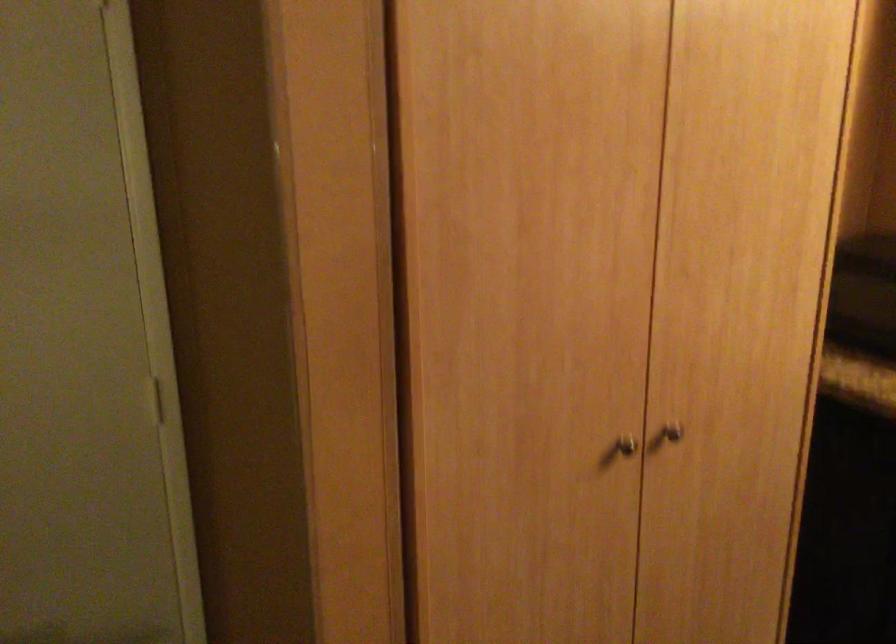
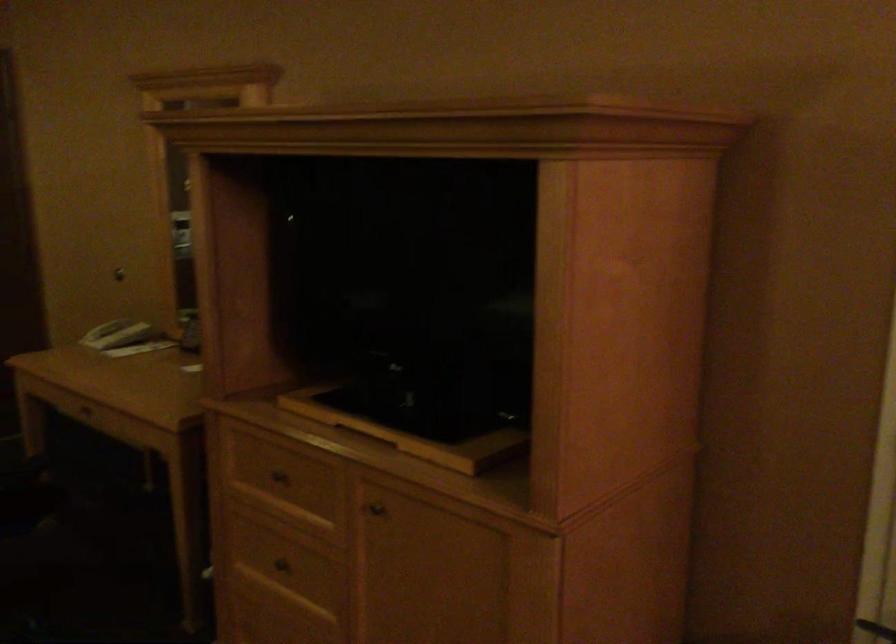
Question: The first image is from the beginning of the video and the second image is from the end. How did the camera likely rotate when shooting the video?

Choices:
 (A) Left
 (B) Right
 (C) Up
 (D) Down

Answer: (A)